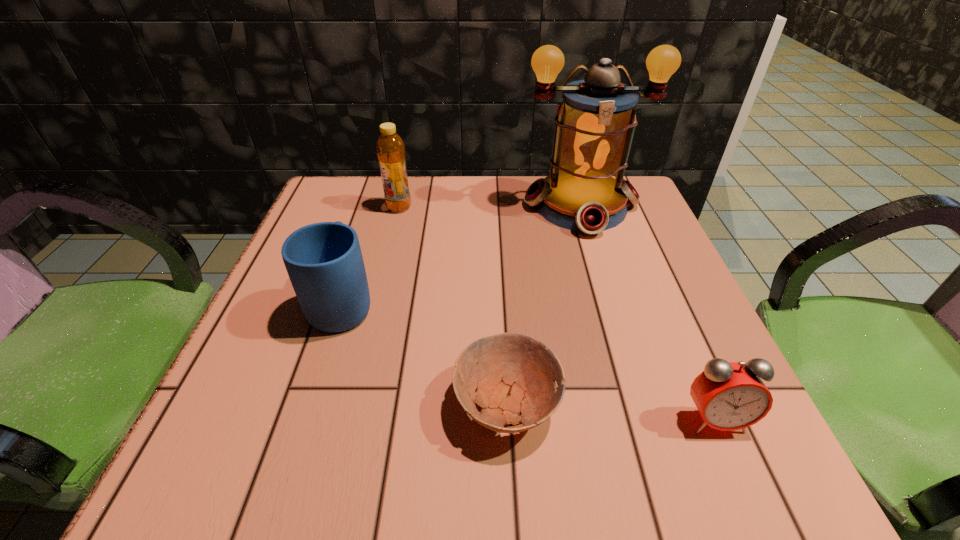
The width and height of the screenshot is (960, 540). I want to click on blank space located 0.080m on the side of the third shortest object with the handle, so click(x=361, y=247).

The height and width of the screenshot is (540, 960). In order to click on vacant space located 0.280m on the left of the shortest object in this screenshot , I will do `click(264, 404)`.

Identify the location of lantern that is at the far edge. (594, 125).

The height and width of the screenshot is (540, 960). In order to click on bottle that is positioned at the far edge in this screenshot , I will do `click(390, 148)`.

Where is `alarm clock present at the near edge`? alarm clock present at the near edge is located at coordinates click(729, 396).

Identify the location of bowl that is at the near edge. The width and height of the screenshot is (960, 540). (512, 373).

Image resolution: width=960 pixels, height=540 pixels. In order to click on object that is positioned at the left edge in this screenshot , I will do `click(324, 261)`.

Locate an element on the screen. The width and height of the screenshot is (960, 540). lantern that is at the right edge is located at coordinates (594, 125).

Where is `alarm clock that is at the right edge`? alarm clock that is at the right edge is located at coordinates pos(729,396).

Find the location of a particular element. The image size is (960, 540). object present at the far right corner is located at coordinates (594, 125).